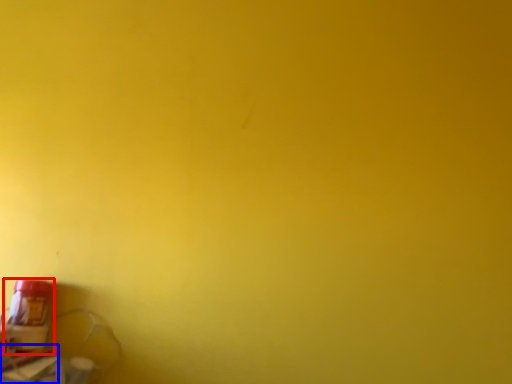
Question: Which object appears farthest to the camera in this image, bottle (highlighted by a red box) or window sill (highlighted by a blue box)?

Choices:
 (A) bottle
 (B) window sill

Answer: (A)